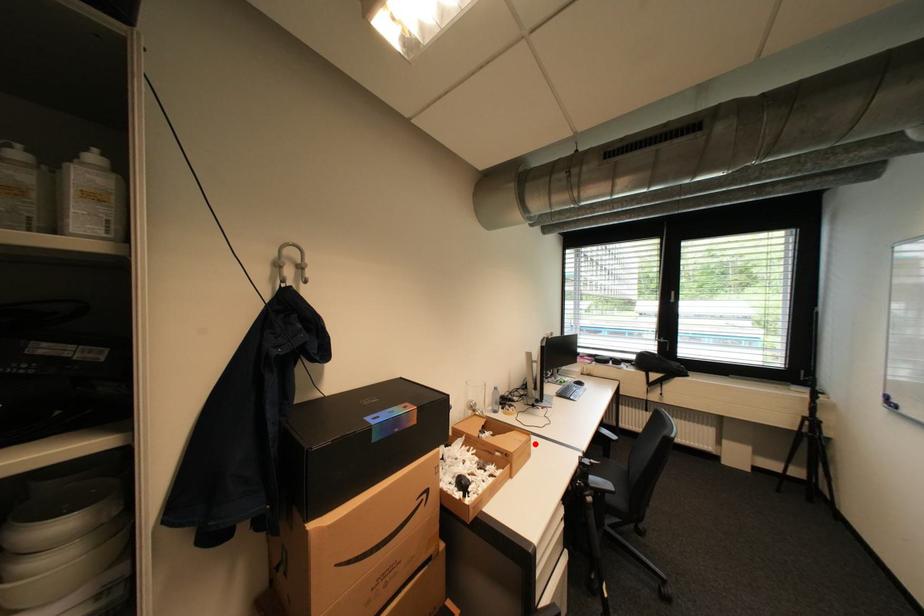
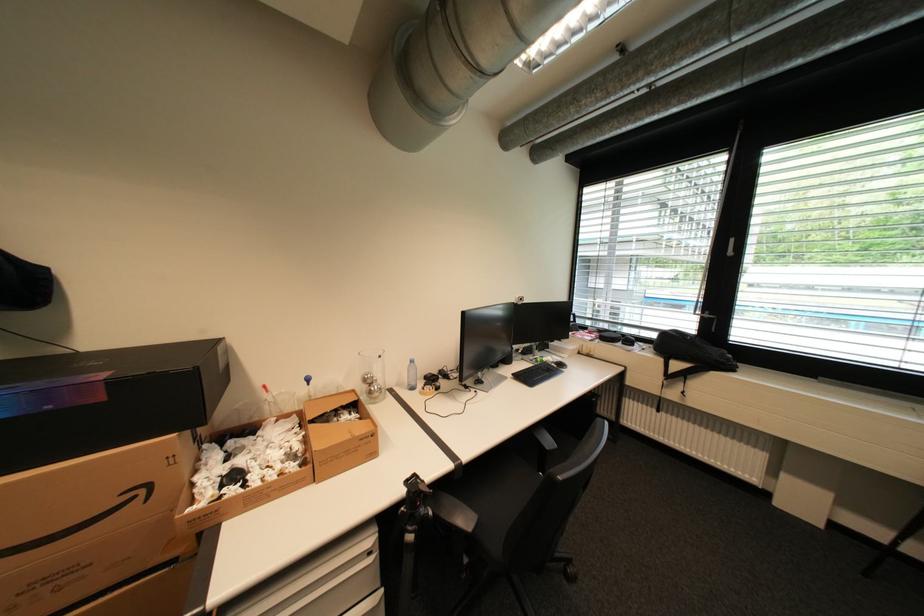
Question: A red point is marked in image1. In image2, is the corresponding 3D point closer to the camera or farther? Reply with the corresponding letter.

Choices:
 (A) The corresponding 3D point is closer.
 (B) The corresponding 3D point is farther.

Answer: (B)